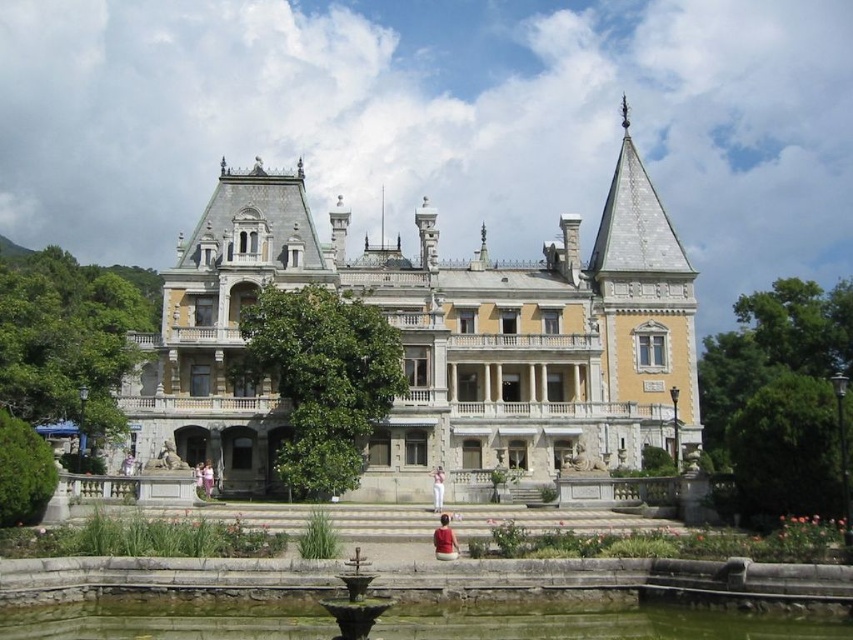
Question: Which point is closer to the camera?

Choices:
 (A) (350, 573)
 (B) (447, 560)
 (C) (434, 468)

Answer: (A)

Question: Does red velvet jacket at lower center come behind white cotton dress at center?

Choices:
 (A) yes
 (B) no

Answer: (B)

Question: Estimate the real-world distances between objects in this image. Which object is closer to the bronze/rough fountain at center?

Choices:
 (A) pink fabric dress at center
 (B) yellow stone palace at center
 (C) greenish stone water at lower center

Answer: (C)

Question: Can you confirm if bronze/rough fountain at center is positioned to the left of red velvet jacket at lower center?

Choices:
 (A) yes
 (B) no

Answer: (A)

Question: Which point is closer to the camera?

Choices:
 (A) (448, 545)
 (B) (433, 484)

Answer: (A)

Question: Can you confirm if yellow stone palace at center is positioned to the right of bronze/rough fountain at center?

Choices:
 (A) no
 (B) yes

Answer: (A)